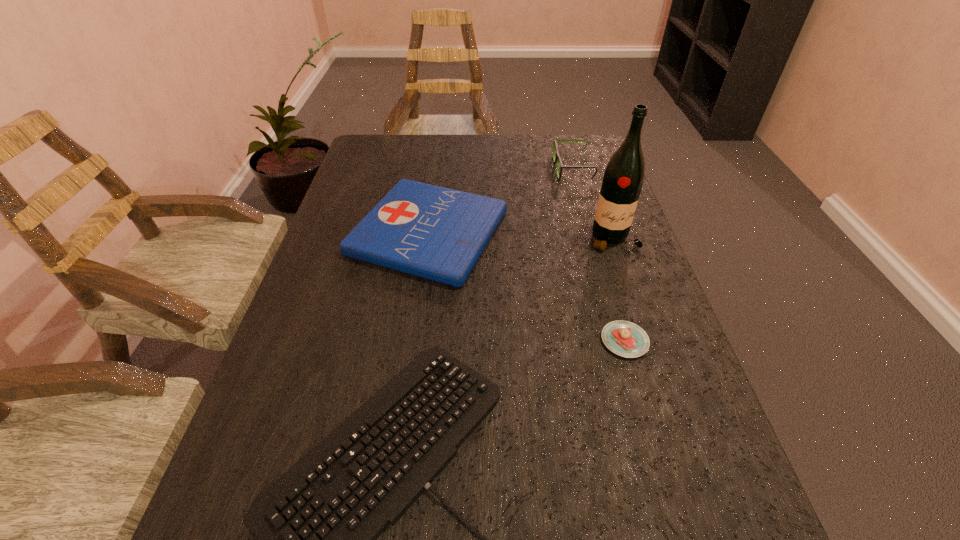
Identify the location of vacant space at the far left corner of the desktop. The height and width of the screenshot is (540, 960). (393, 153).

This screenshot has width=960, height=540. In order to click on vacant space at the far right corner of the desktop in this screenshot , I will do `click(568, 165)`.

Where is `free point between the tallest object and the fourth tallest object`? Image resolution: width=960 pixels, height=540 pixels. free point between the tallest object and the fourth tallest object is located at coordinates (619, 290).

Locate an element on the screen. free space between the pastry and the third shortest object is located at coordinates (527, 287).

Identify the location of blank region between the pastry and the farthest object. Image resolution: width=960 pixels, height=540 pixels. (598, 255).

Locate an element on the screen. This screenshot has width=960, height=540. empty location between the fourth tallest object and the wine bottle is located at coordinates (619, 290).

Find the location of a particular element. The height and width of the screenshot is (540, 960). empty space between the first-aid kit and the tallest object is located at coordinates (521, 236).

Identify which object is the closest to the pastry. Please provide its 2D coordinates. Your answer should be formatted as a tuple, i.e. [(x, y)], where the tuple contains the x and y coordinates of a point satisfying the conditions above.

[(437, 233)]

This screenshot has height=540, width=960. In order to click on object that stands as the closest to the third tallest object in this screenshot , I will do `click(318, 524)`.

Locate an element on the screen. The height and width of the screenshot is (540, 960). vacant area that satisfies the following two spatial constraints: 1. on the lens of the spectacles; 2. on the left side of the second shortest object is located at coordinates (622, 341).